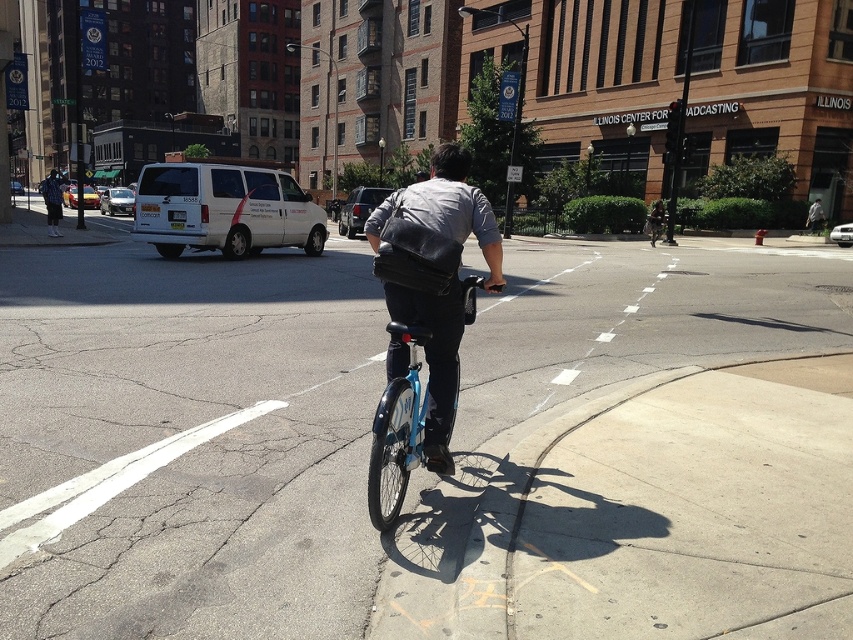
From the picture: You are a delivery person who needs to choose between the blue metallic bicycle at center and the matte black bicycle at center. Which bicycle is closer to the curb marked with a yellow X?

The blue metallic bicycle at center is closer to the curb marked with a yellow X because it is positioned to the left of the matte black bicycle at center, and the yellow X is on the curb to the right side of the frame.

You are a delivery driver who needs to park your vehicle in the no parking zone marked by the yellow X. You see a white matte van at left and a matte black bicycle at center. Can you park your vehicle between them without overlapping any other objects?

The white matte van at left is positioned on the left side of matte black bicycle at center. Since the no parking zone is marked by the yellow X, you cannot park there. Additionally, the space between the van and the bicycle may not be suitable for parking due to the bicycle being in the center, so it is not advisable to park between them.